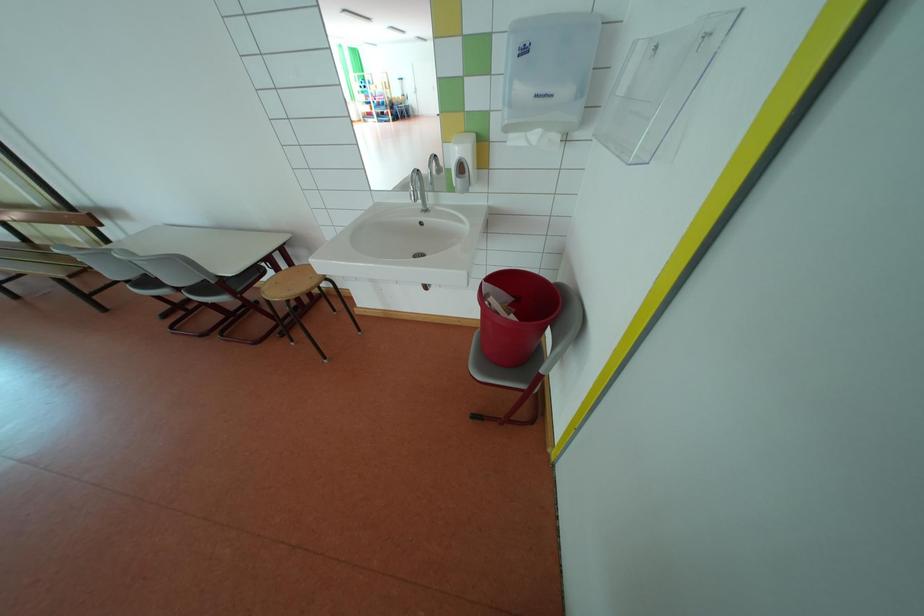
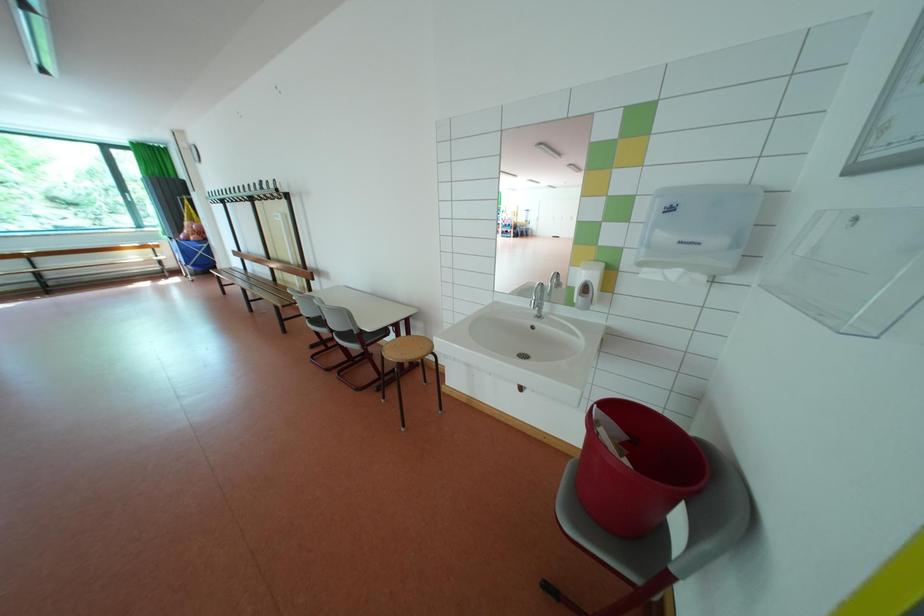
How did the camera likely rotate?

The camera rotated toward left-up.